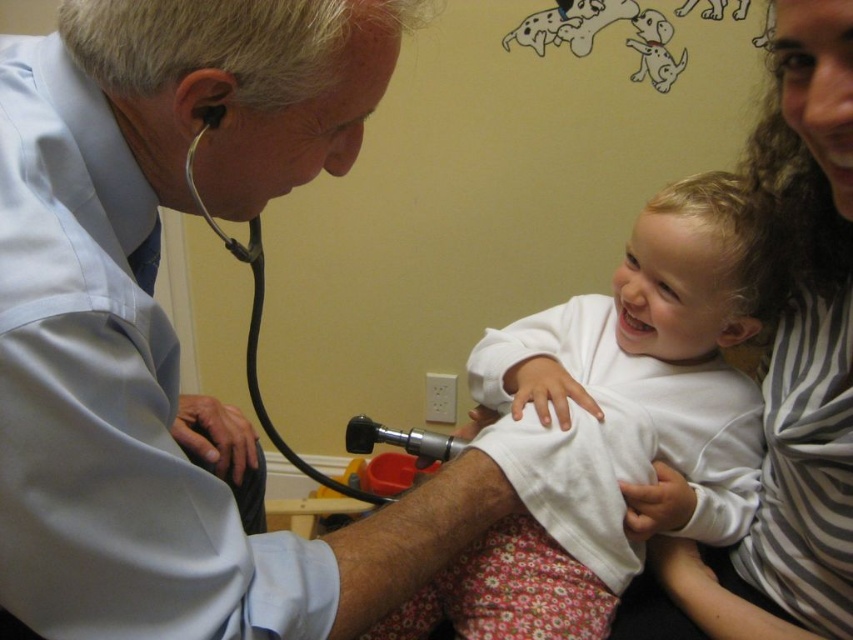
Between white matte shirt at center and metallic black stethoscope at left, which one appears on the left side from the viewer's perspective?

Positioned to the left is metallic black stethoscope at left.

Between white matte shirt at center and metallic black stethoscope at left, which one has less height?

Standing shorter between the two is metallic black stethoscope at left.

Does point (738, 470) come behind point (258, 221)?

Yes, point (738, 470) is farther from viewer.

The image size is (853, 640). Find the location of `white matte shirt at center`. white matte shirt at center is located at coordinates (614, 420).

Is point (834, 240) positioned before point (434, 435)?

Yes, point (834, 240) is in front of point (434, 435).

Between point (762, 600) and point (251, 244), which one is positioned in front?

Positioned in front is point (251, 244).

Which is behind, point (827, 403) or point (256, 300)?

The point (256, 300) is behind.

Where is `striped fabric at upper right`? This screenshot has width=853, height=640. striped fabric at upper right is located at coordinates (787, 378).

Which of these two, white matte shirt at center or striped fabric at upper right, stands taller?

With more height is striped fabric at upper right.

Is point (693, 508) positioned before point (850, 292)?

No, it is not.

The height and width of the screenshot is (640, 853). I want to click on white matte shirt at center, so click(x=614, y=420).